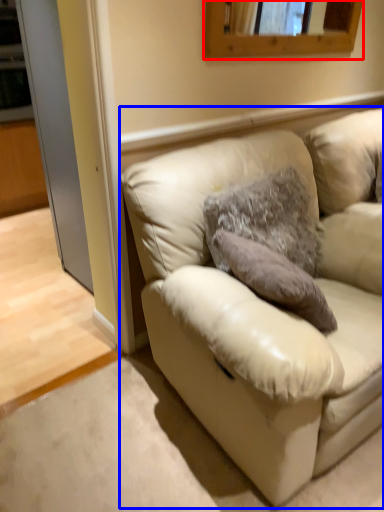
Question: Which point is further to the camera, mirror (highlighted by a red box) or studio couch (highlighted by a blue box)?

Choices:
 (A) mirror
 (B) studio couch

Answer: (A)